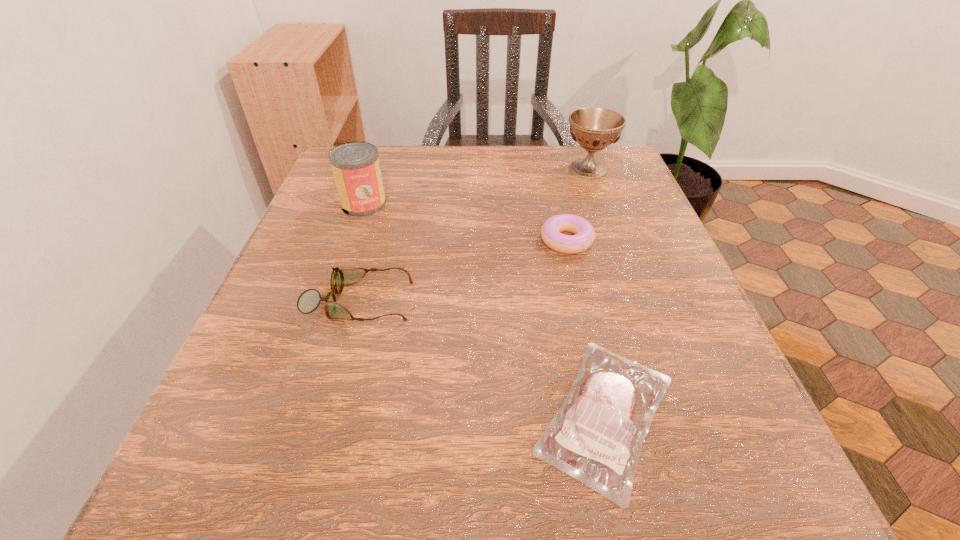
Identify the location of steak at the right edge. (596, 437).

This screenshot has width=960, height=540. Identify the location of object present at the far left corner. (356, 169).

This screenshot has height=540, width=960. I want to click on object that is at the far right corner, so click(x=594, y=128).

You are a GUI agent. You are given a task and a screenshot of the screen. Output one action in this format:
    pyautogui.click(x=<x>, y=<y>)
    Task: Click on the object that is positioned at the near right corner
    The image size is (960, 540).
    Given the screenshot: What is the action you would take?
    pyautogui.click(x=596, y=437)

Identify the location of vacant region at the far edge of the desktop. The height and width of the screenshot is (540, 960). (430, 180).

The width and height of the screenshot is (960, 540). Find the location of `vacant area at the near edge of the desktop`. vacant area at the near edge of the desktop is located at coordinates (532, 496).

Identify the location of free spot at the left edge of the desktop. (354, 257).

I want to click on vacant space at the right edge, so click(x=661, y=333).

In the image, there is a desktop. Identify the location of vacant space at the far right corner. The image size is (960, 540). (580, 156).

Image resolution: width=960 pixels, height=540 pixels. Find the location of `vacant space at the near right corner of the desktop`. vacant space at the near right corner of the desktop is located at coordinates (705, 516).